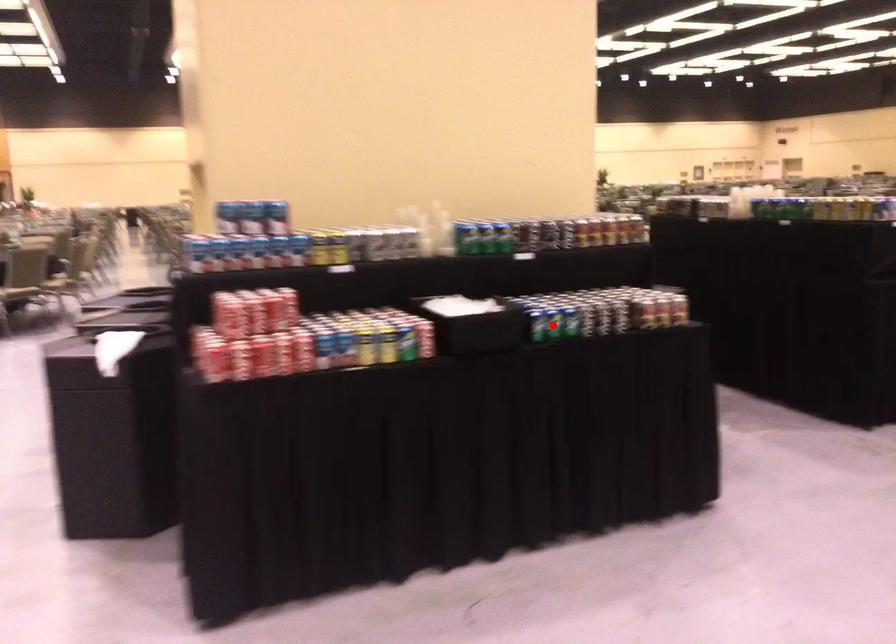
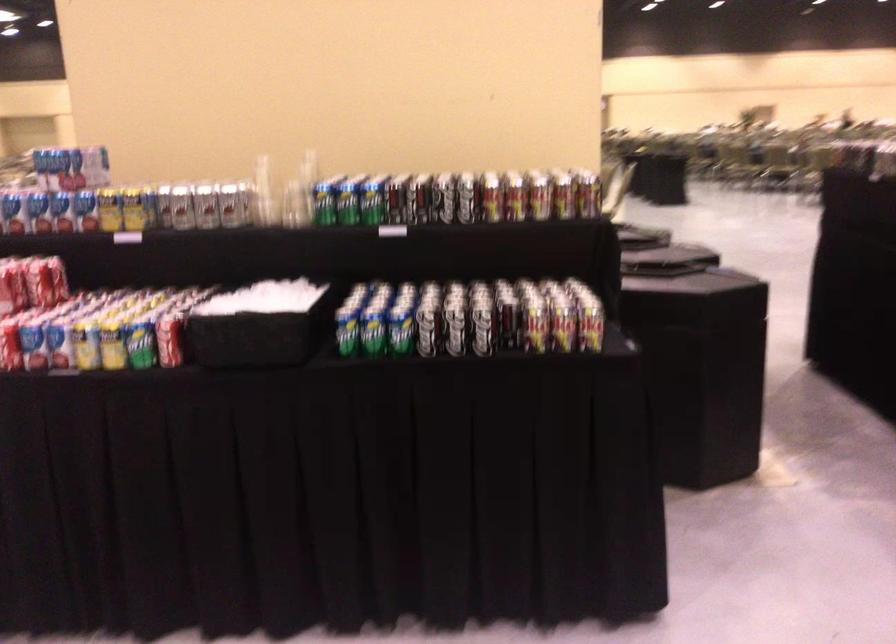
Find the pixel in the second image that matches the highlighted location in the first image.

(374, 335)